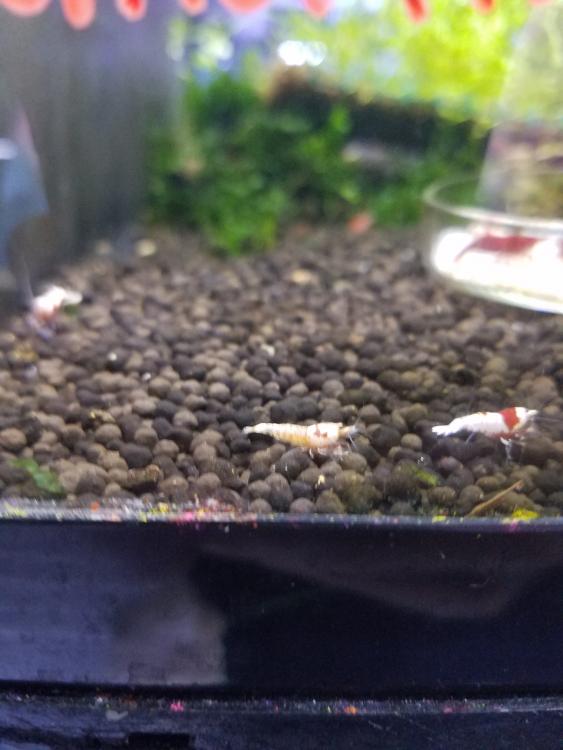
Where is `wall`? The width and height of the screenshot is (563, 750). wall is located at coordinates (93, 73).